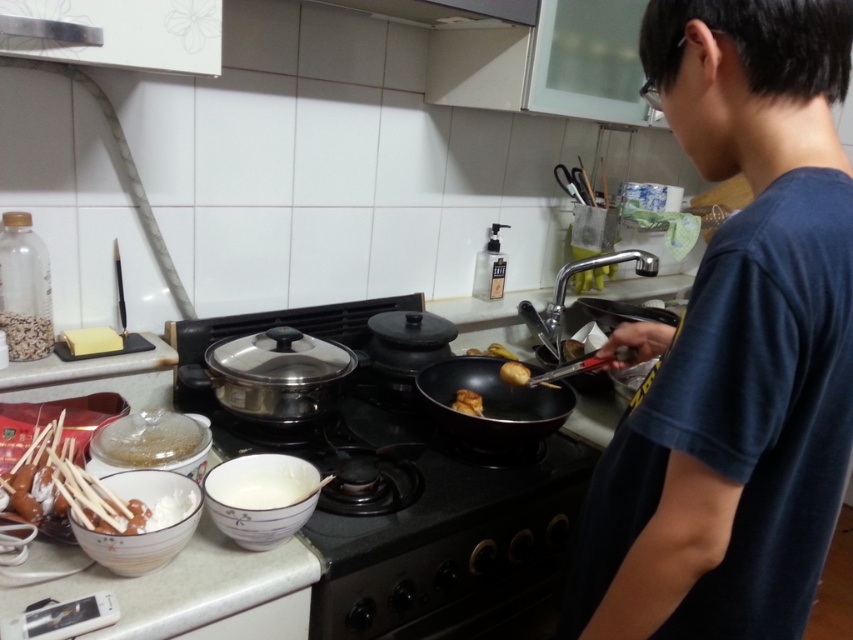
Is black matte gas stove at center below black matte wok at center?

Indeed, black matte gas stove at center is positioned under black matte wok at center.

Between point (386, 413) and point (538, 404), which one is positioned in front?

Point (538, 404) is in front.

What are the coordinates of `black matte gas stove at center` in the screenshot? It's located at (405, 497).

Find the location of `black matte gas stove at center`. black matte gas stove at center is located at coordinates (405, 497).

Which is above, black matte gas stove at center or golden crispy chicken at center?

Positioned higher is golden crispy chicken at center.

Does point (376, 412) lie in front of point (529, 371)?

No, it is behind (529, 371).

Find the location of a particular element. Image resolution: width=853 pixels, height=640 pixels. black matte gas stove at center is located at coordinates (405, 497).

Does dark blue t-shirt at right have a larger size compared to golden crispy fried chicken at center?

Yes.

How much distance is there between dark blue t-shirt at right and golden crispy fried chicken at center?

The distance of dark blue t-shirt at right from golden crispy fried chicken at center is 28.26 inches.

Who is more forward, (701,355) or (476,412)?

Positioned in front is point (701,355).

Image resolution: width=853 pixels, height=640 pixels. I want to click on dark blue t-shirt at right, so click(735, 346).